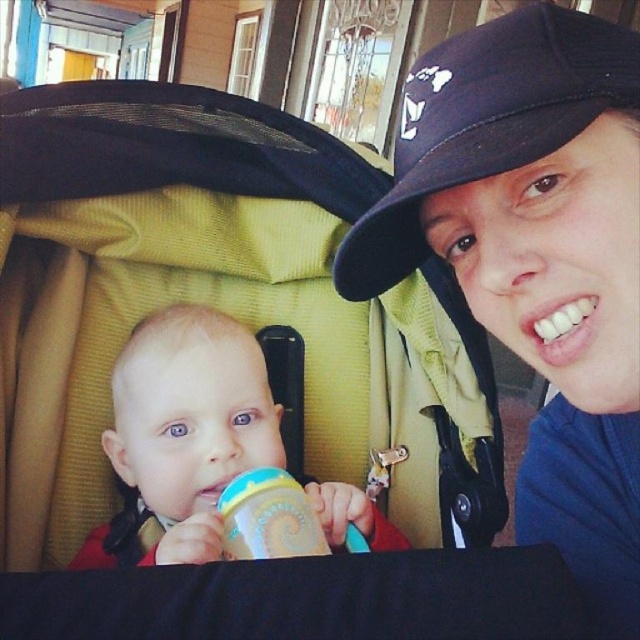
Which is more to the left, navy blue fabric cap at upper right or smooth plastic cup at center?

Positioned to the left is smooth plastic cup at center.

Is point (605, 92) in front of point (387, 525)?

Yes, it is.

Between point (576, 35) and point (189, 467), which one is positioned behind?

The point (189, 467) is behind.

The height and width of the screenshot is (640, 640). What are the coordinates of `navy blue fabric cap at upper right` in the screenshot? It's located at (486, 122).

Can you confirm if blue fabric cap at upper center is wider than navy blue fabric cap at upper right?

Yes.

Which is behind, point (452, 244) or point (362, 284)?

Point (362, 284)

Between point (634, 545) and point (532, 147), which one is positioned in front?

Point (532, 147)

You are a GUI agent. You are given a task and a screenshot of the screen. Output one action in this format:
    pyautogui.click(x=<x>, y=<y>)
    Task: Click on the blue fabric cap at upper center
    
    Given the screenshot: What is the action you would take?
    pyautogui.click(x=536, y=259)

Does smooth plastic cup at center have a greater height compared to blue plastic sippy cup at center?

Yes, smooth plastic cup at center is taller than blue plastic sippy cup at center.

Between smooth plastic cup at center and blue plastic sippy cup at center, which one appears on the right side from the viewer's perspective?

blue plastic sippy cup at center

The image size is (640, 640). What are the coordinates of `smooth plastic cup at center` in the screenshot? It's located at (182, 435).